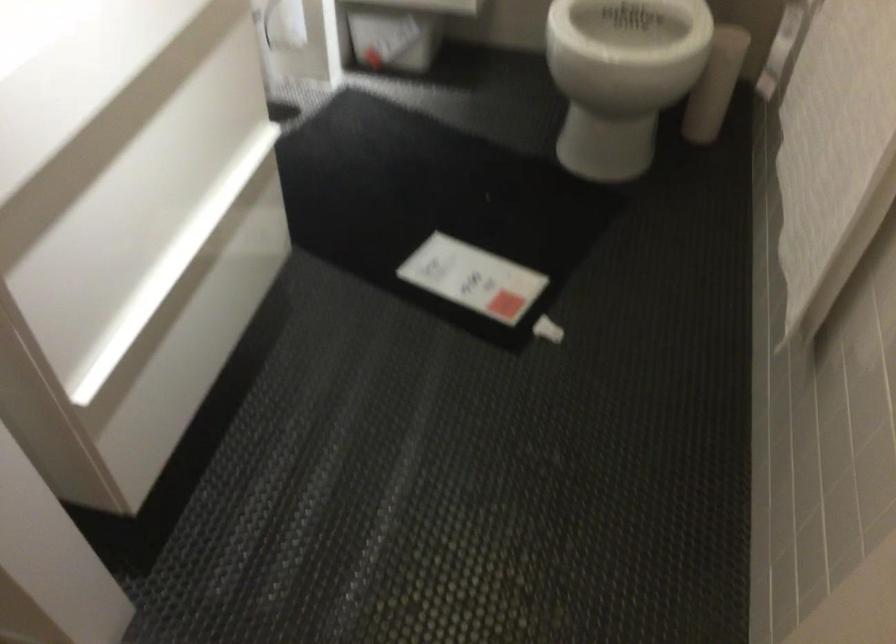
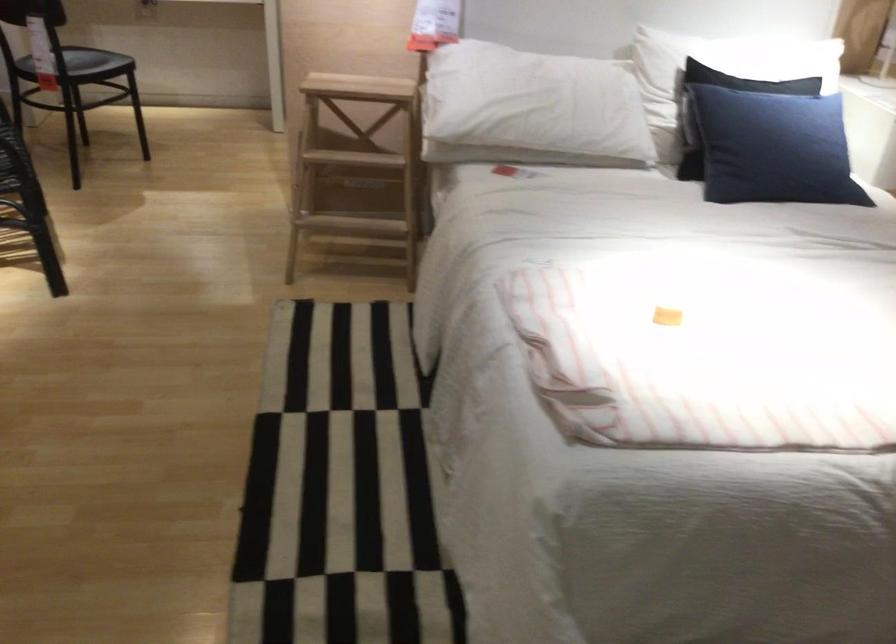
Question: I am providing you with two images of the same scene from different viewpoints. Which of the following objects are not visible in image2?

Choices:
 (A) white toilet lid
 (B) wooden step stool
 (C) red file organizer
 (D) black chair sitting surface

Answer: (A)